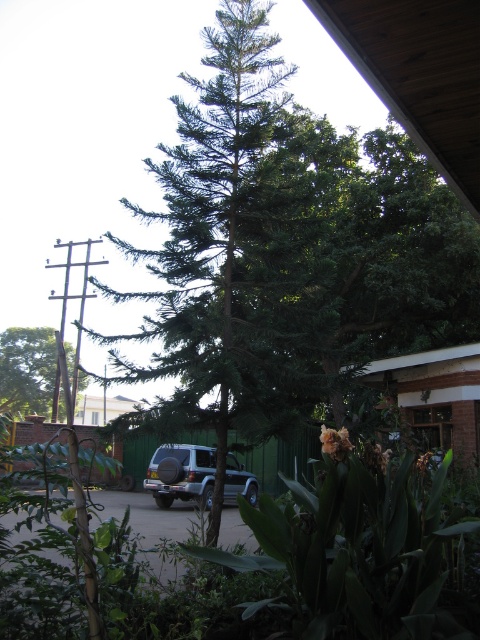
You are standing in the residential garden and want to take a photo of both the flowering plant and the pine tree. You notice two points marked in the scene. The first point is at coordinate point (1, 404) and the second is at point (227, 472). Which point should you focus on to ensure both the flowering plant and the pine tree are in clear view?

You should focus on point (1, 404) because it is closer to the camera than point (227, 472), allowing both the flowering plant and the pine tree to be in clear view.

You are a delivery person trying to park your vehicle in the driveway. You notice the green matte tree at left and the satin silver suv at center. Which object is positioned higher in the scene?

The green matte tree at left is positioned higher than the satin silver suv at center in the scene.